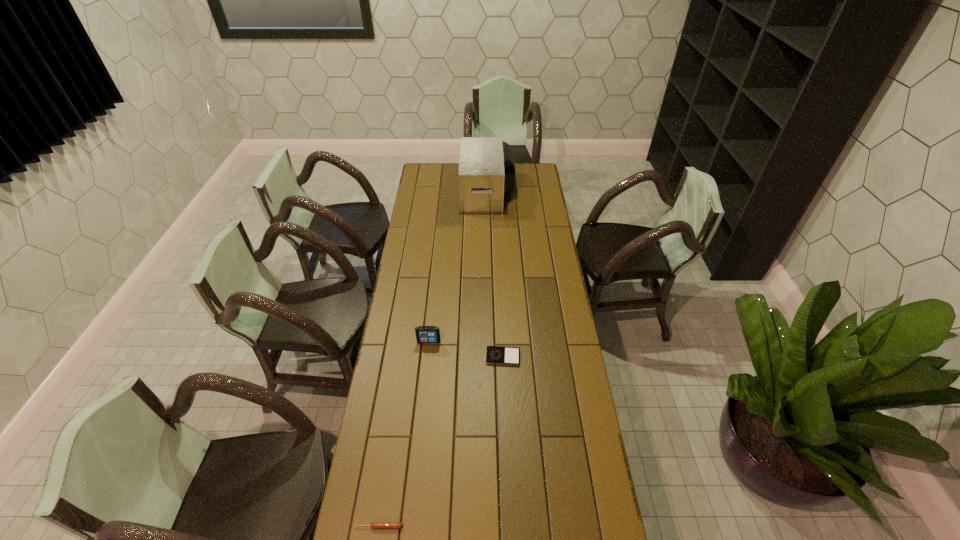
At what (x,y) coordinates should I click in order to perform the action: click on microwave oven. Please return your answer as a coordinate pair (x, y). The image size is (960, 540). Looking at the image, I should click on (486, 173).

At what (x,y) coordinates should I click in order to perform the action: click on the farthest object. Please return your answer as a coordinate pair (x, y). Looking at the image, I should click on 486,173.

Locate an element on the screen. This screenshot has width=960, height=540. the third shortest object is located at coordinates (424, 334).

Locate an element on the screen. The width and height of the screenshot is (960, 540). the taller iPod is located at coordinates (424, 334).

This screenshot has width=960, height=540. I want to click on the nearest object, so click(374, 525).

You are a GUI agent. You are given a task and a screenshot of the screen. Output one action in this format:
    pyautogui.click(x=<x>, y=<y>)
    Task: Click on the third tallest object
    
    Given the screenshot: What is the action you would take?
    pyautogui.click(x=374, y=525)

You are a GUI agent. You are given a task and a screenshot of the screen. Output one action in this format:
    pyautogui.click(x=<x>, y=<y>)
    Task: Click on the nearer iPod
    The width and height of the screenshot is (960, 540).
    Given the screenshot: What is the action you would take?
    pyautogui.click(x=498, y=355)

Identify the location of the shortest object. The width and height of the screenshot is (960, 540). (498, 355).

This screenshot has width=960, height=540. Identify the location of vacant region located 0.080m on the front-facing side of the tallest object. (447, 192).

Locate an element on the screen. This screenshot has width=960, height=540. blank space located 0.170m on the front-facing side of the tallest object is located at coordinates (432, 192).